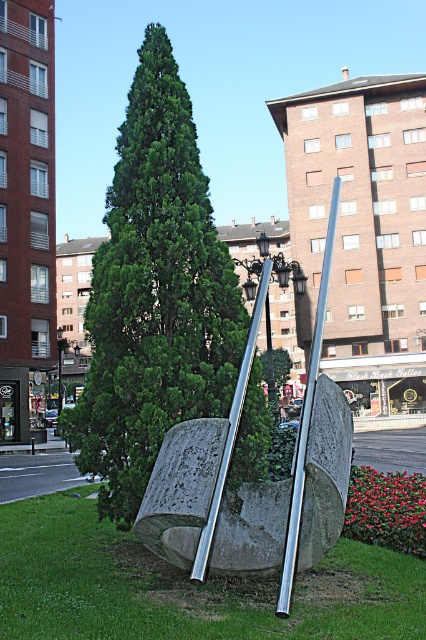
Question: Considering the relative positions of green leafy tree at center and silver polished metal sculpture at center in the image provided, where is green leafy tree at center located with respect to silver polished metal sculpture at center?

Choices:
 (A) left
 (B) right

Answer: (A)

Question: Which of the following is the farthest from the observer?

Choices:
 (A) (282, 584)
 (B) (172, 545)
 (C) (264, 292)

Answer: (C)

Question: Which point is farther to the camera?

Choices:
 (A) silver polished pole at center
 (B) silver polished metal sculpture at center

Answer: (A)

Question: Can you confirm if silver polished metal sculpture at center is thinner than polished silver pole at center?

Choices:
 (A) no
 (B) yes

Answer: (A)

Question: Which object appears closest to the camera in this image?

Choices:
 (A) polished silver pole at center
 (B) silver polished pole at center
 (C) green leafy tree at center

Answer: (A)

Question: Does green leafy tree at center have a greater width compared to polished silver pole at center?

Choices:
 (A) no
 (B) yes

Answer: (B)